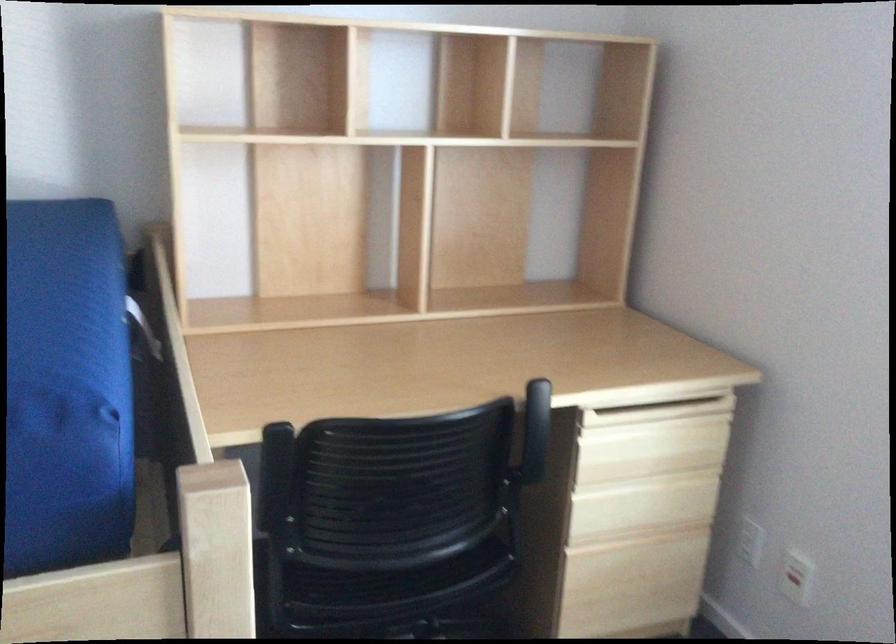
This screenshot has height=644, width=896. Describe the element at coordinates (795, 583) in the screenshot. I see `the red outlet switch` at that location.